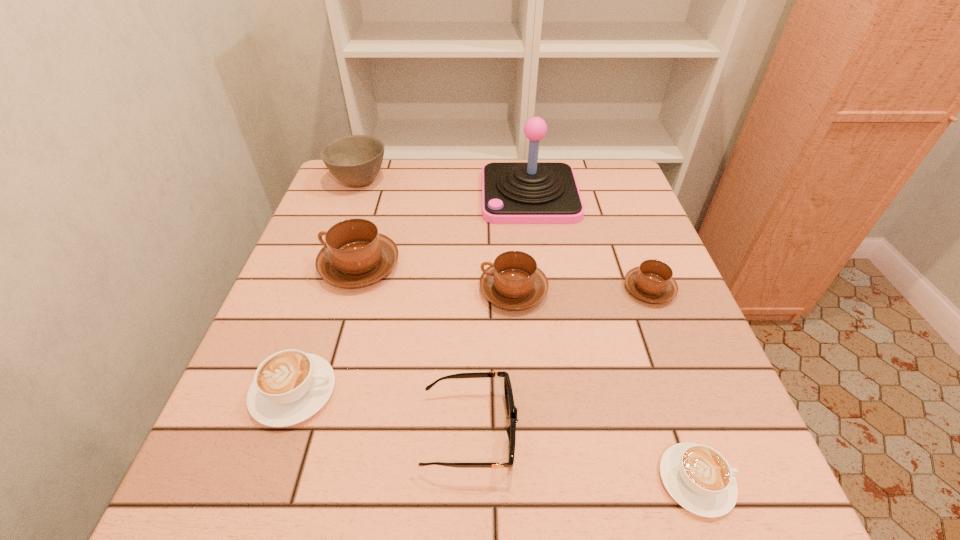
Where is `vacant space in between the left white cappuccino and the joystick`? vacant space in between the left white cappuccino and the joystick is located at coordinates (412, 294).

Identify which object is the sixth nearest to the tallest object. Please provide its 2D coordinates. Your answer should be formatted as a tuple, i.e. [(x, y)], where the tuple contains the x and y coordinates of a point satisfying the conditions above.

[(290, 386)]

Find the location of a particular element. the fourth closest object to the black sunglasses is located at coordinates (355, 254).

This screenshot has width=960, height=540. I want to click on cappuccino identified as the fourth closest to the second nearest cappuccino, so click(x=652, y=281).

The image size is (960, 540). What are the coordinates of `cappuccino object that ranks as the second closest to the tallest object` in the screenshot? It's located at (652, 281).

Locate which brown cappuccino is the closest to the black sunglasses. Please provide its 2D coordinates. Your answer should be formatted as a tuple, i.e. [(x, y)], where the tuple contains the x and y coordinates of a point satisfying the conditions above.

[(513, 281)]

Point out which brown cappuccino is positioned as the third nearest to the right white cappuccino. Please provide its 2D coordinates. Your answer should be formatted as a tuple, i.e. [(x, y)], where the tuple contains the x and y coordinates of a point satisfying the conditions above.

[(355, 254)]

I want to click on free space that satisfies the following two spatial constraints: 1. forward from the base of the tallest object; 2. on the side of the smallest brown cappuccino with the handle, so click(543, 289).

What are the coordinates of `free spot that satisfies the following two spatial constraints: 1. on the side of the rightmost brown cappuccino with the handle; 2. forward from the base of the joystick` in the screenshot? It's located at (613, 195).

In order to click on free location that satisfies the following two spatial constraints: 1. on the side of the smallest brown cappuccino with the handle; 2. on the side of the leftmost brown cappuccino with the handle in this screenshot , I will do `click(640, 266)`.